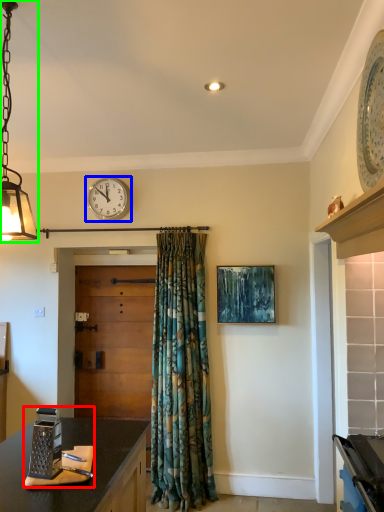
Question: Which object is the closest to the appliance (highlighted by a red box)? Choose among these: wall clock (highlighted by a blue box) or lamp (highlighted by a green box).

Choices:
 (A) wall clock
 (B) lamp

Answer: (B)